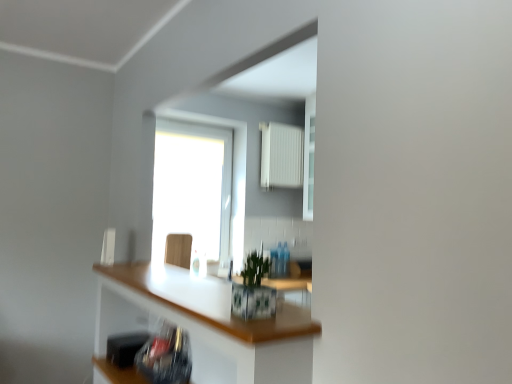
Question: Should I look upward or downward to see wooden swivel chair at center?

Choices:
 (A) down
 (B) up

Answer: (A)

Question: From the image's perspective, is transparent glass window at center beneath white glossy countertop at center?

Choices:
 (A) yes
 (B) no

Answer: (B)

Question: Is transparent glass window at center thinner than white glossy countertop at center?

Choices:
 (A) yes
 (B) no

Answer: (A)

Question: Is transparent glass window at center facing towards white glossy countertop at center?

Choices:
 (A) no
 (B) yes

Answer: (B)

Question: Can you confirm if transparent glass window at center is taller than white glossy countertop at center?

Choices:
 (A) no
 (B) yes

Answer: (B)

Question: Considering the relative positions of transparent glass window at center and white glossy countertop at center in the image provided, is transparent glass window at center to the left of white glossy countertop at center from the viewer's perspective?

Choices:
 (A) yes
 (B) no

Answer: (A)

Question: Is transparent glass window at center positioned far away from white glossy countertop at center?

Choices:
 (A) no
 (B) yes

Answer: (B)

Question: Does white plastic radiator at upper center lie in front of transparent glass window at center?

Choices:
 (A) yes
 (B) no

Answer: (B)

Question: Does white plastic radiator at upper center have a lesser width compared to transparent glass window at center?

Choices:
 (A) no
 (B) yes

Answer: (A)

Question: Can you confirm if white plastic radiator at upper center is positioned to the left of transparent glass window at center?

Choices:
 (A) no
 (B) yes

Answer: (A)

Question: Is white plastic radiator at upper center wider than transparent glass window at center?

Choices:
 (A) no
 (B) yes

Answer: (B)

Question: Is white plastic radiator at upper center not close to transparent glass window at center?

Choices:
 (A) yes
 (B) no

Answer: (B)

Question: Is transparent glass window at center at the back of white plastic radiator at upper center?

Choices:
 (A) yes
 (B) no

Answer: (B)

Question: Is transparent glass window at center taller than black plastic toaster at lower left?

Choices:
 (A) no
 (B) yes

Answer: (B)